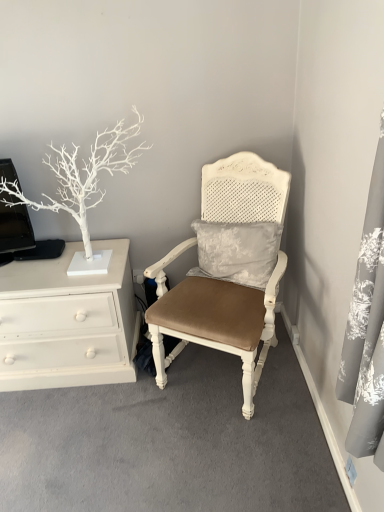
This screenshot has width=384, height=512. Find the location of `free space in front of matte white chair at center`. free space in front of matte white chair at center is located at coordinates (220, 451).